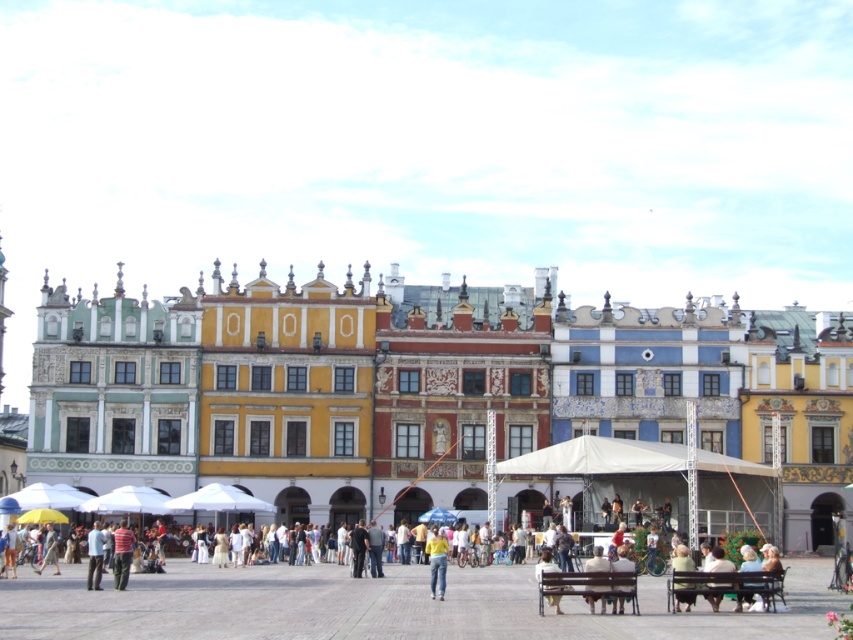
Who is positioned more to the right, yellow matte shirt at center or light blue fabric jacket at lower left?

yellow matte shirt at center is more to the right.

What do you see at coordinates (437, 561) in the screenshot? I see `yellow matte shirt at center` at bounding box center [437, 561].

Where is `yellow matte shirt at center`? Image resolution: width=853 pixels, height=640 pixels. yellow matte shirt at center is located at coordinates (437, 561).

Is multicolored painted buildings at center shorter than white fabric canopy at center?

No, multicolored painted buildings at center is not shorter than white fabric canopy at center.

Is point (454, 566) positioned behind point (746, 467)?

No, (454, 566) is closer to viewer.

This screenshot has height=640, width=853. Find the location of `multicolored painted buildings at center`. multicolored painted buildings at center is located at coordinates (370, 605).

Is striped shirt at lower left below light blue fabric jacket at lower left?

No.

Is point (131, 534) closer to camera compared to point (102, 548)?

Yes.

Where is `striped shirt at lower left`? The width and height of the screenshot is (853, 640). striped shirt at lower left is located at coordinates (122, 554).